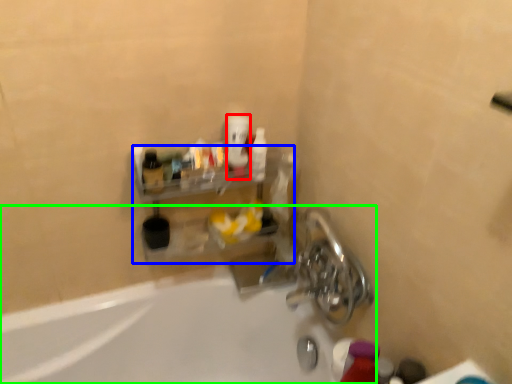
Question: Which is nearer to the mouthwash (highlighted by a red box)? shelf (highlighted by a blue box) or bathtub (highlighted by a green box).

Choices:
 (A) shelf
 (B) bathtub

Answer: (A)